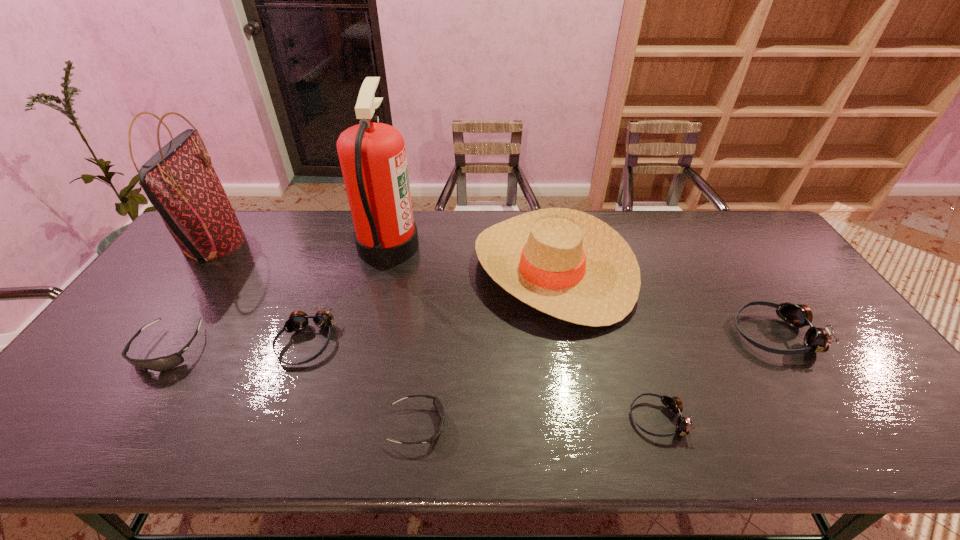
This screenshot has width=960, height=540. What are the coordinates of `empty space that is in between the nearer black goggles and the fifth shortest object` in the screenshot? It's located at (596, 380).

Identify the location of free space between the handbag and the red fire extinguisher. The height and width of the screenshot is (540, 960). (301, 245).

Locate an element on the screen. The width and height of the screenshot is (960, 540). vacant space that is in between the biggest bronze goggles and the smallest bronze goggles is located at coordinates (716, 376).

Find the location of `free spot between the fourth goggles from right to left and the sunhat`. free spot between the fourth goggles from right to left and the sunhat is located at coordinates (429, 306).

Find the location of a particular element. This screenshot has width=960, height=540. vacant point located between the left black goggles and the handbag is located at coordinates (192, 296).

Where is `free area in between the second biggest bronze goggles and the fire extinguisher`? The image size is (960, 540). free area in between the second biggest bronze goggles and the fire extinguisher is located at coordinates (348, 294).

Where is `object that is the seventh nearest to the smaller black goggles`? object that is the seventh nearest to the smaller black goggles is located at coordinates (818, 340).

Where is `the seventh closest object to the third tallest object`? The width and height of the screenshot is (960, 540). the seventh closest object to the third tallest object is located at coordinates (179, 180).

Identify which goggles is located as the second nearest to the tallest goggles. Please provide its 2D coordinates. Your answer should be formatted as a tuple, i.e. [(x, y)], where the tuple contains the x and y coordinates of a point satisfying the conditions above.

[(437, 403)]

Identify which goggles is located as the fourth nearest to the farther black goggles. Please provide its 2D coordinates. Your answer should be formatted as a tuple, i.e. [(x, y)], where the tuple contains the x and y coordinates of a point satisfying the conditions above.

[(818, 340)]